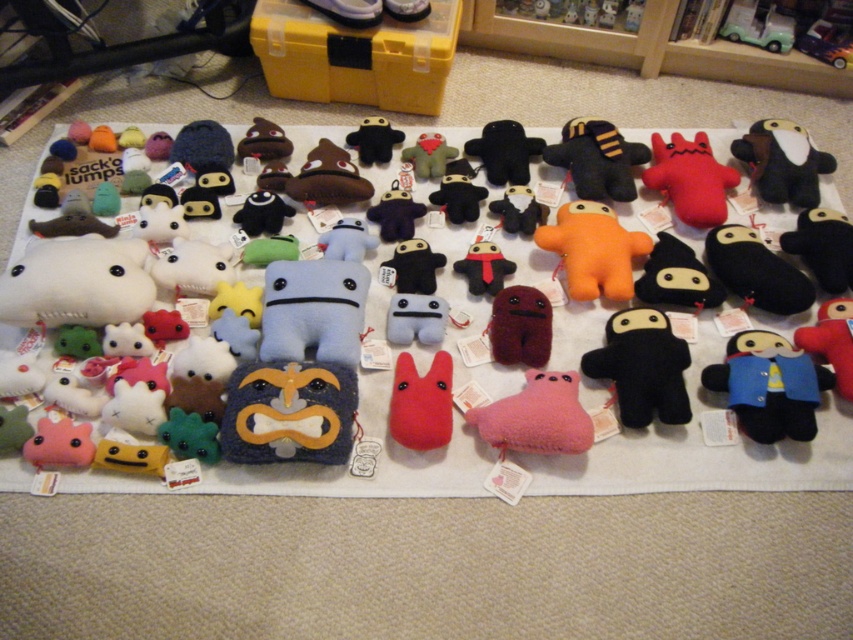
Between blue plush toy at lower right and green matte toy car at upper right, which one appears on the right side from the viewer's perspective?

From the viewer's perspective, green matte toy car at upper right appears more on the right side.

What do you see at coordinates (769, 385) in the screenshot? I see `blue plush toy at lower right` at bounding box center [769, 385].

In order to click on blue plush toy at lower right in this screenshot , I will do `click(769, 385)`.

Locate an element on the screen. The width and height of the screenshot is (853, 640). fluffy pink plush at center is located at coordinates (537, 417).

Between point (740, 29) and point (473, 262), which one is positioned in front?

Point (473, 262) is more forward.

Describe the element at coordinates (757, 26) in the screenshot. This screenshot has height=640, width=853. I see `green matte toy car at upper right` at that location.

Find the location of a particular element. green matte toy car at upper right is located at coordinates (757, 26).